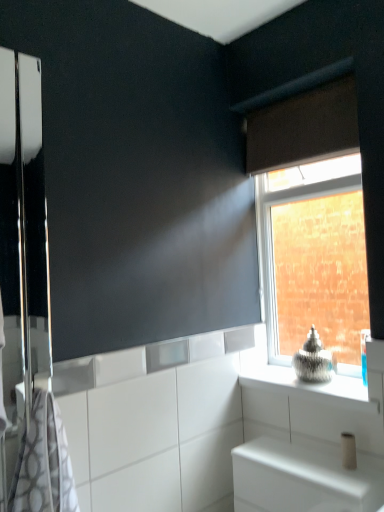
The height and width of the screenshot is (512, 384). What are the coordinates of `free location in front of white matte toilet paper at lower right` in the screenshot? It's located at (353, 481).